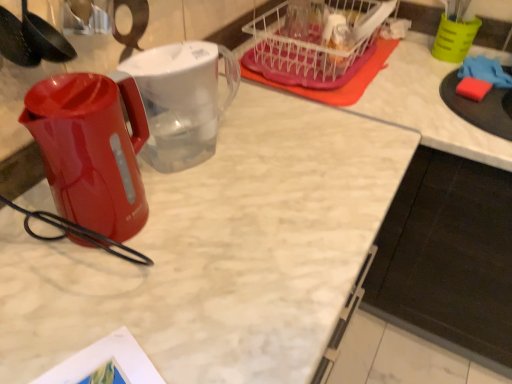
Locate an element on the screen. This screenshot has height=384, width=512. empty space that is ontop of transparent plastic pitcher at center (from a real-world perspective) is located at coordinates (173, 55).